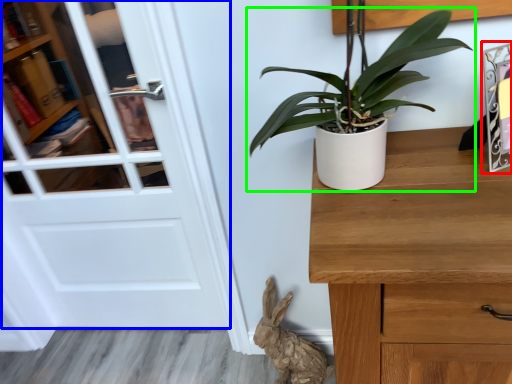
Question: Considering the real-world distances, which object is closest to picture frame (highlighted by a red box)? door (highlighted by a blue box) or houseplant (highlighted by a green box).

Choices:
 (A) door
 (B) houseplant

Answer: (B)